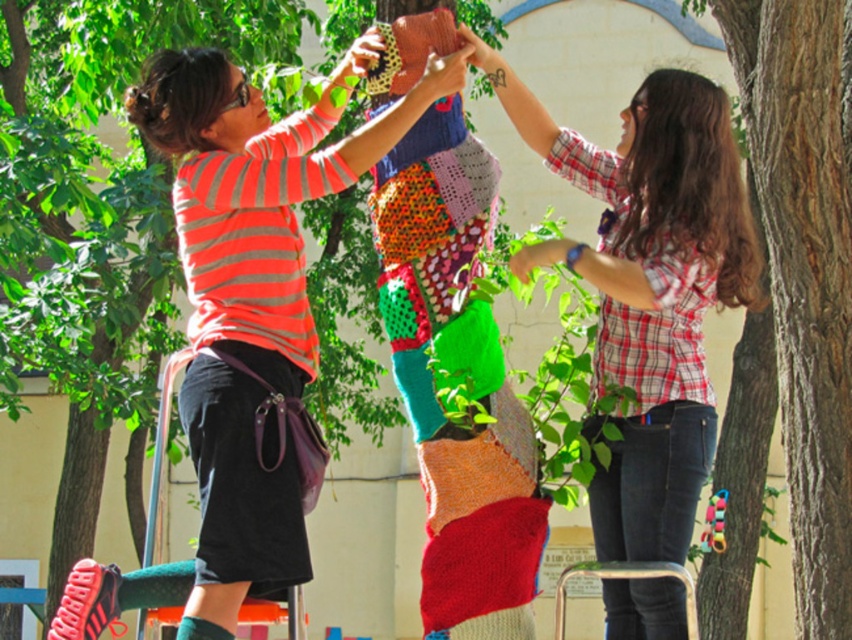
Where is the knitted fabric doll at center located in the image?

The knitted fabric doll at center is located at point (252, 300).

You are a photographer trying to capture a clear photo of the knitted fabric doll at center without the plaid shirt at upper right blocking it. Based on their positions, is this possible?

The knitted fabric doll at center is in front of the plaid shirt at upper right, so it is blocking the view of the doll. Therefore, it is not possible to take a clear photo of the knitted fabric doll at center without the plaid shirt at upper right blocking it.